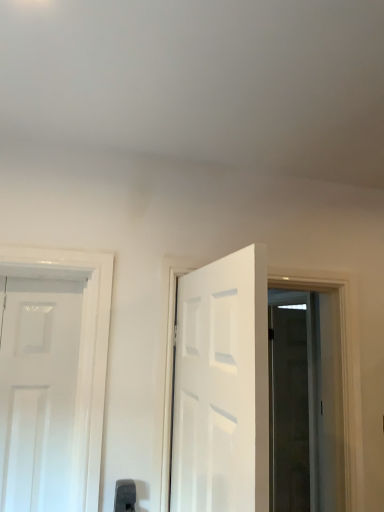
Question: Considering the positions of black plastic door handle at lower center and transparent glass door at right in the image, is black plastic door handle at lower center wider or thinner than transparent glass door at right?

Choices:
 (A) thin
 (B) wide

Answer: (A)

Question: Based on their sizes in the image, would you say black plastic door handle at lower center is bigger or smaller than transparent glass door at right?

Choices:
 (A) small
 (B) big

Answer: (A)

Question: Based on their relative distances, which object is farther from the white glossy door at center?

Choices:
 (A) transparent glass door at right
 (B) black plastic door handle at lower center

Answer: (A)

Question: Based on their relative distances, which object is nearer to the black plastic door handle at lower center?

Choices:
 (A) white glossy door at center
 (B) transparent glass door at right

Answer: (A)